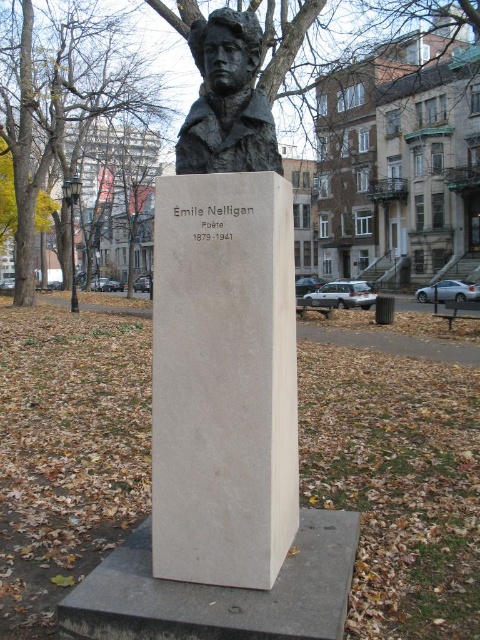
Question: Can you confirm if yellow leafy tree at upper left is positioned to the right of bronze bust at upper center?

Choices:
 (A) yes
 (B) no

Answer: (B)

Question: Can you confirm if yellow leafy tree at upper left is positioned to the left of bronze bust at upper center?

Choices:
 (A) yes
 (B) no

Answer: (A)

Question: Estimate the real-world distances between objects in this image. Which object is closer to the green leafy tree at upper left?

Choices:
 (A) bronze bust at upper center
 (B) white marble bust at center
 (C) yellow leafy tree at upper left

Answer: (C)

Question: Observing the image, what is the correct spatial positioning of green leafy tree at upper left in reference to bronze bust at upper center?

Choices:
 (A) above
 (B) below

Answer: (A)

Question: Which object is farther from the camera taking this photo?

Choices:
 (A) green leafy tree at upper left
 (B) bronze bust at upper center

Answer: (A)

Question: Among these objects, which one is nearest to the camera?

Choices:
 (A) white marble bust at center
 (B) bronze bust at upper center
 (C) yellow leafy tree at upper left
 (D) green leafy tree at upper left

Answer: (A)